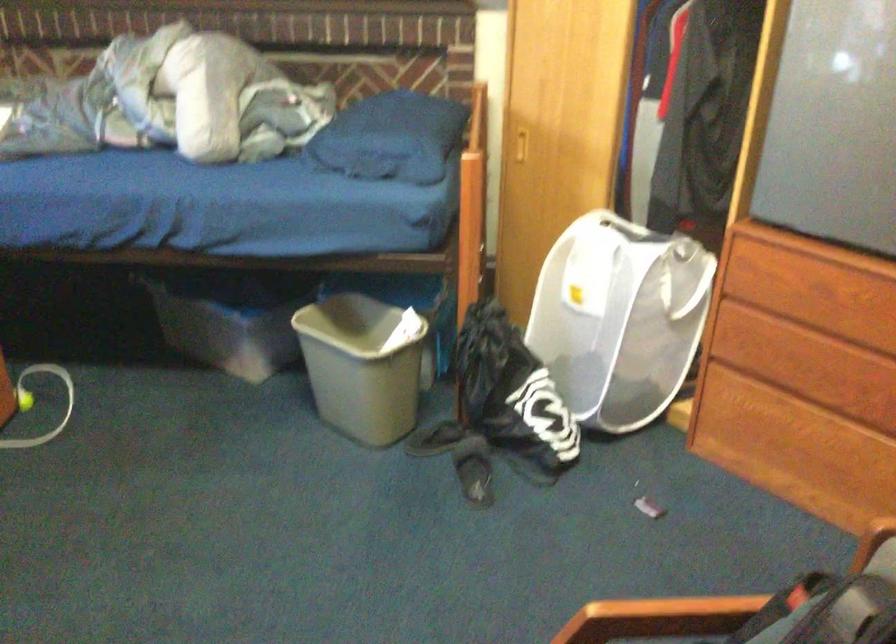
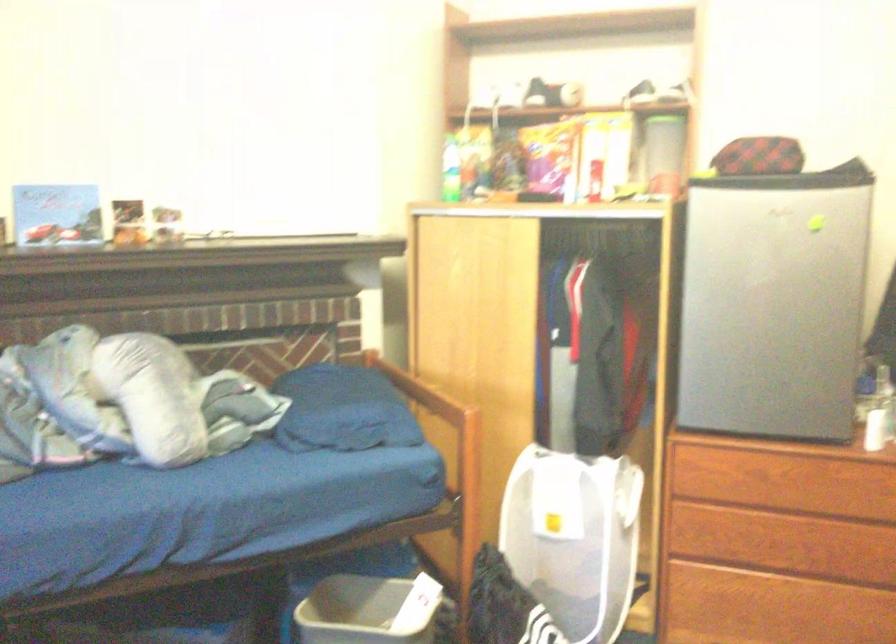
Locate, in the second image, the point that corresponds to pixel 598 315 in the first image.

(574, 538)